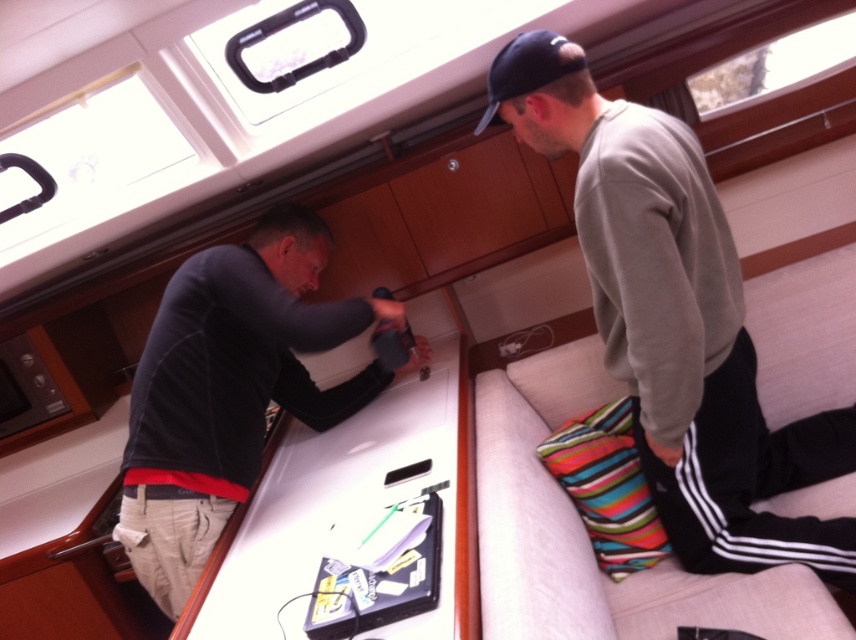
You are a photographer taking a picture of the light gray sweater at upper right and the black matte shirt at center. Which one should you focus on first if you want to capture both in the same frame?

The light gray sweater at upper right is located above the black matte shirt at center, so you should focus on the black matte shirt at center first to ensure both are in focus as it is closer to the camera.

You are designing a new wardrobe for the cabin. Both the light gray sweater at upper right and the black matte shirt at center need to be hung on the same hanger. Which garment should you place on the wider hanger?

The light gray sweater at upper right should be placed on the wider hanger because its width surpasses that of the black matte shirt at center.